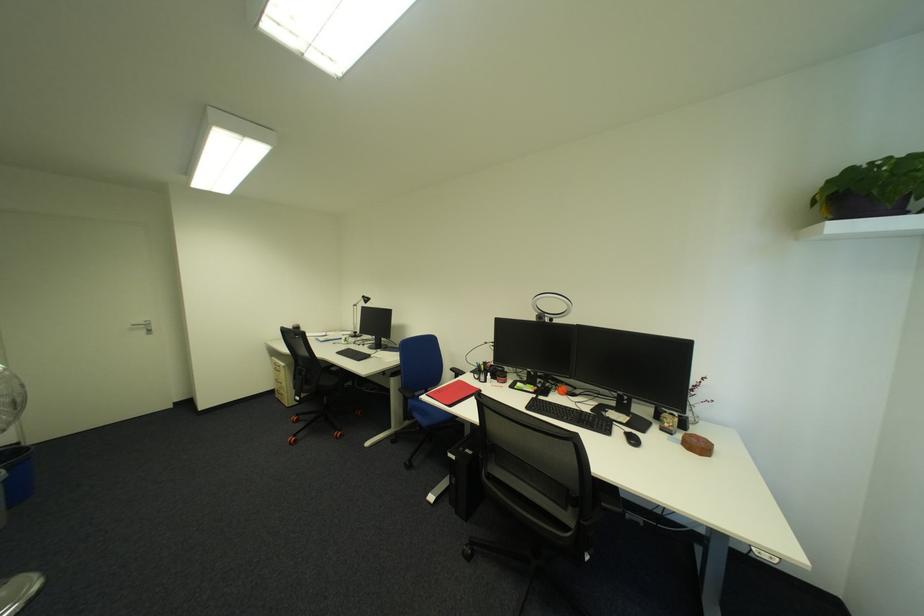
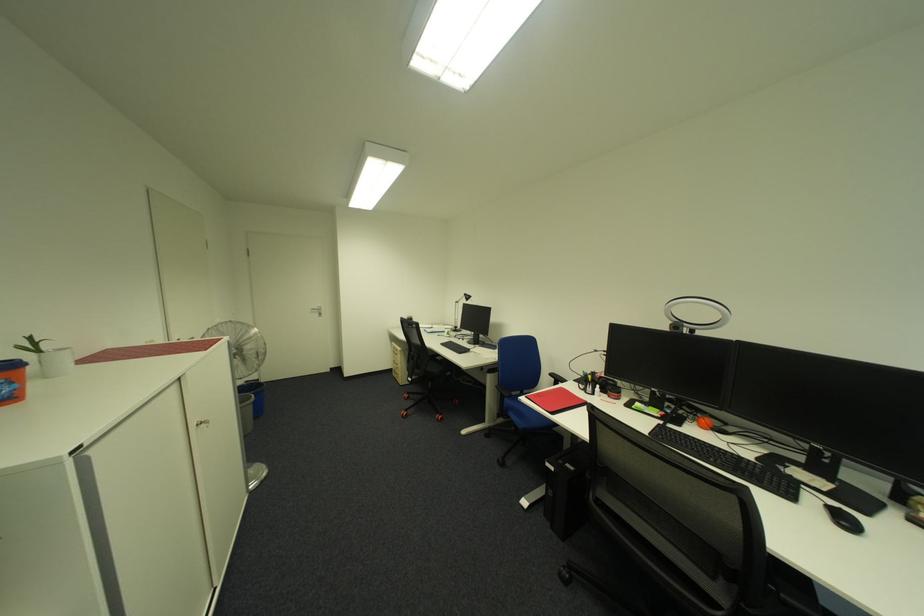
Question: Which direction would the cameraman need to move to produce the second image? Reply with the corresponding letter.

Choices:
 (A) Left
 (B) Right
 (C) Forward
 (D) Backward

Answer: (A)